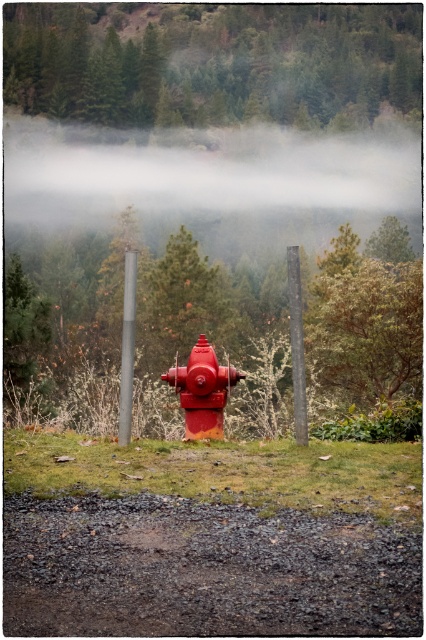
Based on the scene description, where is the green matte tree at upper center located in terms of its 2D coordinates?

The green matte tree at upper center is located at the 2D coordinates of point (213,61).

You are a painter setting up an easel to paint the scene. You need to place your easel behind both the metallic pole at center and the smooth wooden post at center so that both are visible in your painting. Is this possible?

The metallic pole at center is shorter than the smooth wooden post at center. Since the easel needs to be placed behind both, the shorter metallic pole at center will not block the view of the taller smooth wooden post at center, so yes, it is possible to place the easel behind both and have both visible in the painting.

You are standing in front of the red fire hydrant in the misty landscape. There are two points marked in the scene. The first point is at coordinates point (196, 387) and the second point is at point (126, 275). Which of these points is closer to you, the observer?

Point (196, 387) is further to the camera than point (126, 275), so the point closer to you is point (126, 275).